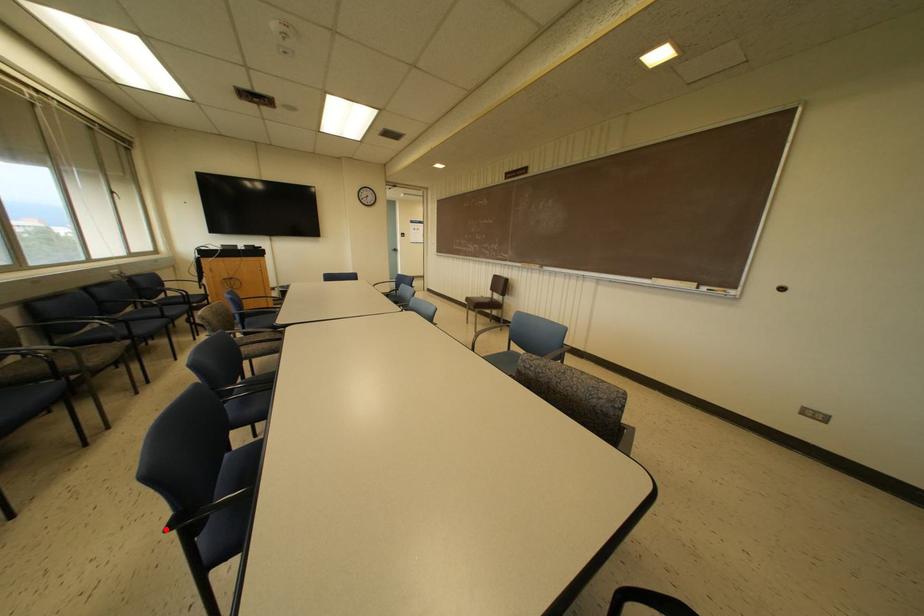
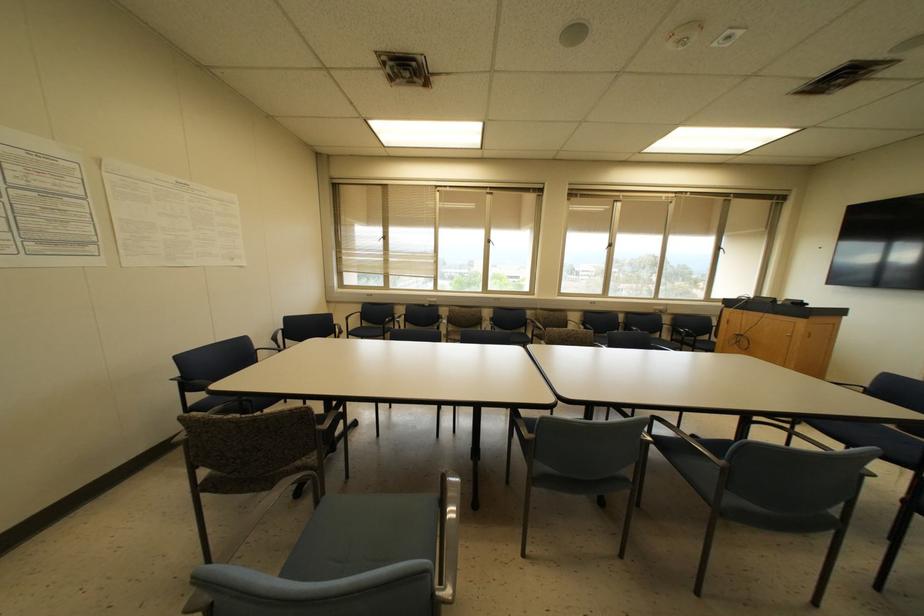
Question: I am providing you with two images of the same scene from different viewpoints. A red point is marked on the first image. Is the red point's position out of view in image 2?

Choices:
 (A) Yes
 (B) No

Answer: (A)